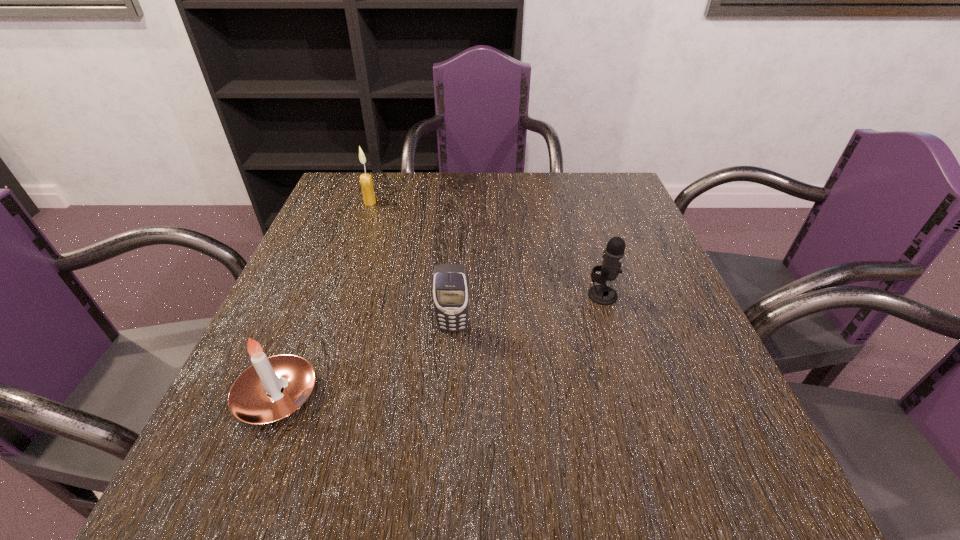
Locate an element on the screen. This screenshot has height=540, width=960. object located at the far edge is located at coordinates (366, 182).

You are a GUI agent. You are given a task and a screenshot of the screen. Output one action in this format:
    pyautogui.click(x=<x>, y=<y>)
    Task: Click on the object situated at the right edge
    This screenshot has width=960, height=540.
    Given the screenshot: What is the action you would take?
    pyautogui.click(x=602, y=294)

Where is `object located in the far left corner section of the desktop`? This screenshot has height=540, width=960. object located in the far left corner section of the desktop is located at coordinates (366, 182).

In the image, there is a desktop. Where is `blank space at the far edge`? The width and height of the screenshot is (960, 540). blank space at the far edge is located at coordinates (498, 189).

Image resolution: width=960 pixels, height=540 pixels. In order to click on vacant position at the left edge of the desktop in this screenshot , I will do `click(278, 342)`.

In the image, there is a desktop. Identify the location of vacant area at the right edge. This screenshot has width=960, height=540. (672, 352).

You are a GUI agent. You are given a task and a screenshot of the screen. Output one action in this format:
    pyautogui.click(x=<x>, y=<y>)
    Task: Click on the blank space at the far left corner
    
    Given the screenshot: What is the action you would take?
    pyautogui.click(x=348, y=196)

I want to click on vacant space at the near left corner of the desktop, so click(x=253, y=509).

The height and width of the screenshot is (540, 960). I want to click on vacant space at the far right corner, so click(x=589, y=181).

I want to click on vacant space that is in between the nearest object and the farthest object, so click(x=324, y=299).